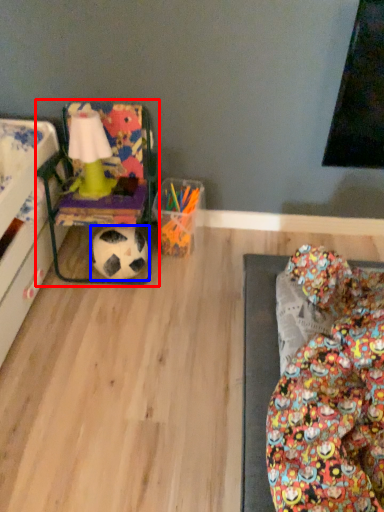
Question: Among these objects, which one is farthest to the camera, bean bag chair (highlighted by a red box) or football (highlighted by a blue box)?

Choices:
 (A) bean bag chair
 (B) football

Answer: (B)